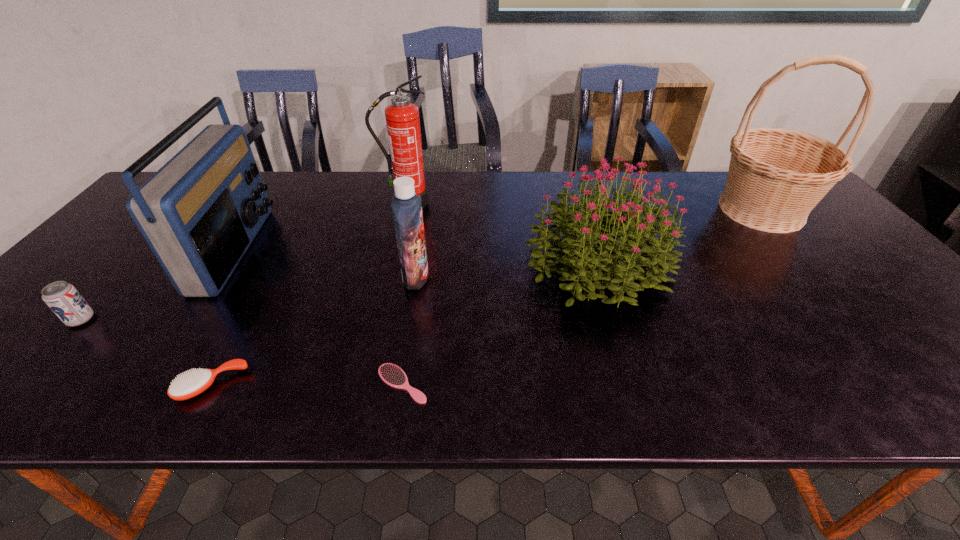
The width and height of the screenshot is (960, 540). In order to click on basket in this screenshot , I will do 776,176.

This screenshot has height=540, width=960. In order to click on fire extinguisher in this screenshot , I will do `click(402, 118)`.

Locate an element on the screen. This screenshot has width=960, height=540. radio receiver is located at coordinates (199, 213).

At what (x,y) coordinates should I click in order to perform the action: click on the seventh object from left to right. Please return your answer as a coordinate pair (x, y). Image resolution: width=960 pixels, height=540 pixels. Looking at the image, I should click on (621, 260).

Find the location of `shampoo`. shampoo is located at coordinates click(x=406, y=206).

Where is `beer can`? beer can is located at coordinates (64, 300).

Image resolution: width=960 pixels, height=540 pixels. In order to click on the sixth tallest object in this screenshot , I will do `click(64, 300)`.

What are the coordinates of `the seventh tallest object` in the screenshot? It's located at (190, 384).

Locate an element on the screen. Image resolution: width=960 pixels, height=540 pixels. the taller hairbrush is located at coordinates (190, 384).

The image size is (960, 540). What are the coordinates of `the shortest object` in the screenshot? It's located at (392, 375).